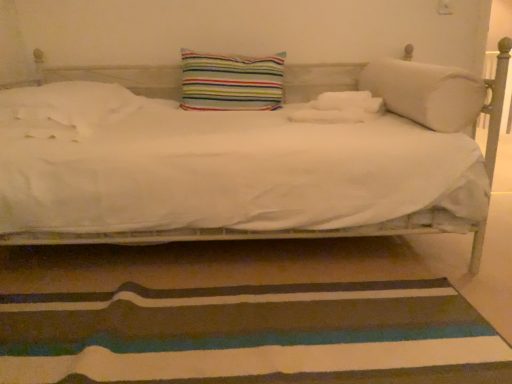
The height and width of the screenshot is (384, 512). Describe the element at coordinates (231, 82) in the screenshot. I see `striped fabric pillow at center, marked as the 2th pillow in a right-to-left arrangement` at that location.

Identify the location of white soft cylindrical pillow at right, the first pillow viewed from the right. This screenshot has width=512, height=384. (426, 93).

Where is `striped fabric doormat at lower center`? striped fabric doormat at lower center is located at coordinates (251, 336).

How many degrees apart are the facing directions of striped fabric pillow at center, marked as the 2th pillow in a right-to-left arrangement, and striped fabric doormat at lower center?

striped fabric pillow at center, marked as the 2th pillow in a right-to-left arrangement, and striped fabric doormat at lower center are facing 89.9 degrees away from each other.

From the image's perspective, is striped fabric pillow at center, arranged as the 2th pillow when viewed from the left, positioned above or below striped fabric doormat at lower center?

Based on their image positions, striped fabric pillow at center, arranged as the 2th pillow when viewed from the left, is located above striped fabric doormat at lower center.

Between striped fabric pillow at center, arranged as the 2th pillow when viewed from the left, and striped fabric doormat at lower center, which one has smaller width?

striped fabric pillow at center, arranged as the 2th pillow when viewed from the left, is thinner.

Which of these two, striped fabric doormat at lower center or striped fabric pillow at center, arranged as the 2th pillow when viewed from the left, is smaller?

Smaller between the two is striped fabric pillow at center, arranged as the 2th pillow when viewed from the left.

Which object is thinner, striped fabric doormat at lower center or striped fabric pillow at center, marked as the 2th pillow in a right-to-left arrangement?

striped fabric pillow at center, marked as the 2th pillow in a right-to-left arrangement, is thinner.

Based on the photo, is striped fabric doormat at lower center turned away from striped fabric pillow at center, arranged as the 2th pillow when viewed from the left?

No.

From a real-world perspective, is striped fabric doormat at lower center on striped fabric pillow at center, marked as the 2th pillow in a right-to-left arrangement?

No, from a real-world perspective, striped fabric doormat at lower center is not on top of striped fabric pillow at center, marked as the 2th pillow in a right-to-left arrangement.

Do you think white soft cylindrical pillow at right, marked as the 3th pillow in a left-to-right arrangement, is within striped fabric doormat at lower center, or outside of it?

white soft cylindrical pillow at right, marked as the 3th pillow in a left-to-right arrangement, is located beyond the bounds of striped fabric doormat at lower center.

Consider the image. Considering the positions of objects white soft cylindrical pillow at right, the first pillow viewed from the right, and striped fabric doormat at lower center in the image provided, who is in front, white soft cylindrical pillow at right, the first pillow viewed from the right, or striped fabric doormat at lower center?

Positioned in front is striped fabric doormat at lower center.

From a real-world perspective, is white soft cylindrical pillow at right, the first pillow viewed from the right, over striped fabric doormat at lower center?

Yes, from a real-world perspective, white soft cylindrical pillow at right, the first pillow viewed from the right, is on top of striped fabric doormat at lower center.

Does white soft cylindrical pillow at right, marked as the 3th pillow in a left-to-right arrangement, have a greater width compared to striped fabric doormat at lower center?

Incorrect, the width of white soft cylindrical pillow at right, marked as the 3th pillow in a left-to-right arrangement, does not surpass that of striped fabric doormat at lower center.

Does white soft pillow at left, the 1th pillow positioned from the left, touch white soft cylindrical pillow at right, the first pillow viewed from the right?

No, white soft pillow at left, the 1th pillow positioned from the left, is not making contact with white soft cylindrical pillow at right, the first pillow viewed from the right.

Consider the image. Considering the positions of objects white soft pillow at left, the 1th pillow positioned from the left, and white soft cylindrical pillow at right, marked as the 3th pillow in a left-to-right arrangement, in the image provided, who is behind, white soft pillow at left, the 1th pillow positioned from the left, or white soft cylindrical pillow at right, marked as the 3th pillow in a left-to-right arrangement,?

Positioned behind is white soft cylindrical pillow at right, marked as the 3th pillow in a left-to-right arrangement.

Does white soft pillow at left, marked as the 3th pillow in a right-to-left arrangement, have a smaller size compared to white soft cylindrical pillow at right, the first pillow viewed from the right?

No, white soft pillow at left, marked as the 3th pillow in a right-to-left arrangement, is not smaller than white soft cylindrical pillow at right, the first pillow viewed from the right.

Is white soft cylindrical pillow at right, marked as the 3th pillow in a left-to-right arrangement, at the back of striped fabric pillow at center, arranged as the 2th pillow when viewed from the left?

striped fabric pillow at center, arranged as the 2th pillow when viewed from the left, is not turned away from white soft cylindrical pillow at right, marked as the 3th pillow in a left-to-right arrangement.

Considering the sizes of objects striped fabric pillow at center, arranged as the 2th pillow when viewed from the left, and white soft cylindrical pillow at right, the first pillow viewed from the right, in the image provided, who is smaller, striped fabric pillow at center, arranged as the 2th pillow when viewed from the left, or white soft cylindrical pillow at right, the first pillow viewed from the right,?

striped fabric pillow at center, arranged as the 2th pillow when viewed from the left.

Would you consider striped fabric pillow at center, arranged as the 2th pillow when viewed from the left, to be distant from white soft cylindrical pillow at right, marked as the 3th pillow in a left-to-right arrangement?

They are positioned close to each other.

Is white soft cylindrical pillow at right, the first pillow viewed from the right, completely or partially inside striped fabric pillow at center, arranged as the 2th pillow when viewed from the left?

No, white soft cylindrical pillow at right, the first pillow viewed from the right, is located outside of striped fabric pillow at center, arranged as the 2th pillow when viewed from the left.

Considering the relative positions of white soft pillow at left, the 1th pillow positioned from the left, and striped fabric doormat at lower center in the image provided, is white soft pillow at left, the 1th pillow positioned from the left, to the left of striped fabric doormat at lower center from the viewer's perspective?

Indeed, white soft pillow at left, the 1th pillow positioned from the left, is positioned on the left side of striped fabric doormat at lower center.

Considering the points (70, 139) and (322, 289), which point is in front, point (70, 139) or point (322, 289)?

The point (70, 139) is in front.

Is white soft pillow at left, marked as the 3th pillow in a right-to-left arrangement, positioned with its back to striped fabric doormat at lower center?

No, striped fabric doormat at lower center is not at the back of white soft pillow at left, marked as the 3th pillow in a right-to-left arrangement.

Who is shorter, white soft pillow at left, marked as the 3th pillow in a right-to-left arrangement, or striped fabric doormat at lower center?

Standing shorter between the two is striped fabric doormat at lower center.

Between striped fabric pillow at center, arranged as the 2th pillow when viewed from the left, and white soft pillow at left, the 1th pillow positioned from the left, which one has more height?

striped fabric pillow at center, arranged as the 2th pillow when viewed from the left.

Considering the positions of points (219, 110) and (72, 137), is point (219, 110) closer to camera compared to point (72, 137)?

No, (219, 110) is behind (72, 137).

Looking at the image, does striped fabric pillow at center, arranged as the 2th pillow when viewed from the left, seem bigger or smaller compared to white soft pillow at left, marked as the 3th pillow in a right-to-left arrangement?

In the image, striped fabric pillow at center, arranged as the 2th pillow when viewed from the left, appears to be smaller than white soft pillow at left, marked as the 3th pillow in a right-to-left arrangement.

How many degrees apart are the facing directions of striped fabric pillow at center, marked as the 2th pillow in a right-to-left arrangement, and white soft pillow at left, marked as the 3th pillow in a right-to-left arrangement?

2.56 degrees separate the facing orientations of striped fabric pillow at center, marked as the 2th pillow in a right-to-left arrangement, and white soft pillow at left, marked as the 3th pillow in a right-to-left arrangement.

Where is `doormat on the right side of striped fabric pillow at center, marked as the 2th pillow in a right-to-left arrangement`? doormat on the right side of striped fabric pillow at center, marked as the 2th pillow in a right-to-left arrangement is located at coordinates (251, 336).

Locate an element on the screen. The width and height of the screenshot is (512, 384). doormat that appears below the striped fabric pillow at center, marked as the 2th pillow in a right-to-left arrangement (from the image's perspective) is located at coordinates (251, 336).

Estimate the real-world distances between objects in this image. Which object is further from striped fabric doormat at lower center, white soft cylindrical pillow at right, marked as the 3th pillow in a left-to-right arrangement, or white soft pillow at left, the 1th pillow positioned from the left?

The object further to striped fabric doormat at lower center is white soft cylindrical pillow at right, marked as the 3th pillow in a left-to-right arrangement.

Looking at the image, which one is located closer to white soft cylindrical pillow at right, marked as the 3th pillow in a left-to-right arrangement, white soft pillow at left, the 1th pillow positioned from the left, or striped fabric doormat at lower center?

The object closer to white soft cylindrical pillow at right, marked as the 3th pillow in a left-to-right arrangement, is striped fabric doormat at lower center.

Looking at the image, which one is located closer to white soft cylindrical pillow at right, the first pillow viewed from the right, striped fabric pillow at center, arranged as the 2th pillow when viewed from the left, or white soft pillow at left, marked as the 3th pillow in a right-to-left arrangement?

striped fabric pillow at center, arranged as the 2th pillow when viewed from the left, lies closer to white soft cylindrical pillow at right, the first pillow viewed from the right, than the other object.

When comparing their distances from striped fabric doormat at lower center, does white soft pillow at left, the 1th pillow positioned from the left, or striped fabric pillow at center, arranged as the 2th pillow when viewed from the left, seem further?

The object further to striped fabric doormat at lower center is striped fabric pillow at center, arranged as the 2th pillow when viewed from the left.

Looking at the image, which one is located closer to white soft pillow at left, marked as the 3th pillow in a right-to-left arrangement, striped fabric doormat at lower center or striped fabric pillow at center, arranged as the 2th pillow when viewed from the left?

Among the two, striped fabric pillow at center, arranged as the 2th pillow when viewed from the left, is located nearer to white soft pillow at left, marked as the 3th pillow in a right-to-left arrangement.

From the image, which object appears to be farther from white soft pillow at left, marked as the 3th pillow in a right-to-left arrangement, white soft cylindrical pillow at right, the first pillow viewed from the right, or striped fabric doormat at lower center?

white soft cylindrical pillow at right, the first pillow viewed from the right, is further to white soft pillow at left, marked as the 3th pillow in a right-to-left arrangement.

Looking at the image, which one is located further to white soft pillow at left, the 1th pillow positioned from the left, striped fabric pillow at center, marked as the 2th pillow in a right-to-left arrangement, or striped fabric doormat at lower center?

striped fabric doormat at lower center is positioned further to the anchor white soft pillow at left, the 1th pillow positioned from the left.

Looking at this image, which object lies nearer to the anchor point white soft cylindrical pillow at right, marked as the 3th pillow in a left-to-right arrangement, striped fabric pillow at center, marked as the 2th pillow in a right-to-left arrangement, or striped fabric doormat at lower center?

Based on the image, striped fabric pillow at center, marked as the 2th pillow in a right-to-left arrangement, appears to be nearer to white soft cylindrical pillow at right, marked as the 3th pillow in a left-to-right arrangement.

At what (x,y) coordinates should I click in order to perform the action: click on pillow between white soft pillow at left, the 1th pillow positioned from the left, and white soft cylindrical pillow at right, marked as the 3th pillow in a left-to-right arrangement, in the horizontal direction. Please return your answer as a coordinate pair (x, y). Looking at the image, I should click on (231, 82).

Locate an element on the screen. The width and height of the screenshot is (512, 384). doormat between white soft pillow at left, the 1th pillow positioned from the left, and white soft cylindrical pillow at right, the first pillow viewed from the right is located at coordinates (251, 336).